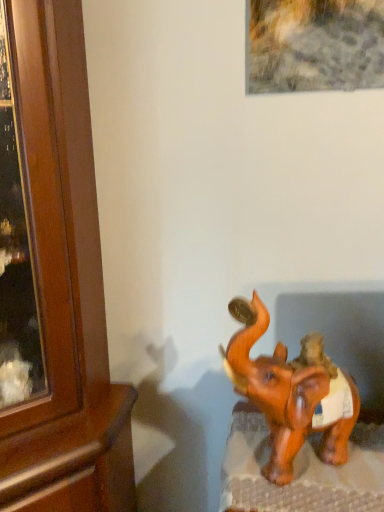
Question: In the image, is wooden cabinet at left positioned in front of or behind brown glossy elephant at lower right?

Choices:
 (A) behind
 (B) front

Answer: (B)

Question: In terms of height, does wooden cabinet at left look taller or shorter compared to brown glossy elephant at lower right?

Choices:
 (A) short
 (B) tall

Answer: (B)

Question: From the image's perspective, is wooden cabinet at left located above or below brown glossy elephant at lower right?

Choices:
 (A) below
 (B) above

Answer: (B)

Question: Based on their sizes in the image, would you say brown glossy elephant at lower right is bigger or smaller than wooden cabinet at left?

Choices:
 (A) small
 (B) big

Answer: (A)

Question: Does point (274, 406) appear closer or farther from the camera than point (99, 352)?

Choices:
 (A) closer
 (B) farther

Answer: (A)

Question: From a real-world perspective, is brown glossy elephant at lower right positioned above or below wooden cabinet at left?

Choices:
 (A) above
 (B) below

Answer: (A)

Question: Is brown glossy elephant at lower right spatially inside wooden cabinet at left, or outside of it?

Choices:
 (A) outside
 (B) inside

Answer: (A)